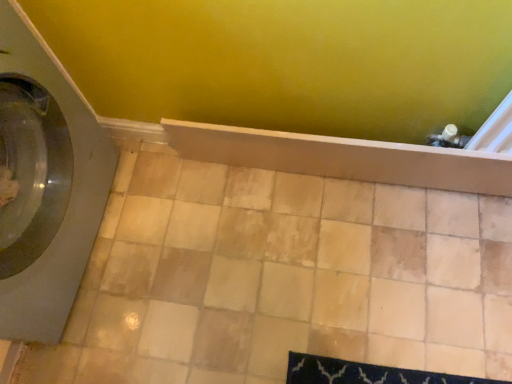
Question: Is satin gray washing machine at left taller than beige ceramic tile at center?

Choices:
 (A) yes
 (B) no

Answer: (A)

Question: Is satin gray washing machine at left facing towards beige ceramic tile at center?

Choices:
 (A) yes
 (B) no

Answer: (A)

Question: Is the depth of satin gray washing machine at left less than that of beige ceramic tile at center?

Choices:
 (A) yes
 (B) no

Answer: (A)

Question: From a real-world perspective, is satin gray washing machine at left located higher than beige ceramic tile at center?

Choices:
 (A) no
 (B) yes

Answer: (B)

Question: Is satin gray washing machine at left next to beige ceramic tile at center?

Choices:
 (A) no
 (B) yes

Answer: (A)

Question: From a real-world perspective, is satin gray washing machine at left below beige ceramic tile at center?

Choices:
 (A) yes
 (B) no

Answer: (B)

Question: Can you confirm if beige ceramic tile at center is shorter than satin gray washing machine at left?

Choices:
 (A) no
 (B) yes

Answer: (B)

Question: Can you see beige ceramic tile at center touching satin gray washing machine at left?

Choices:
 (A) yes
 (B) no

Answer: (B)

Question: Is beige ceramic tile at center to the left of satin gray washing machine at left from the viewer's perspective?

Choices:
 (A) yes
 (B) no

Answer: (B)

Question: Does beige ceramic tile at center appear on the right side of satin gray washing machine at left?

Choices:
 (A) no
 (B) yes

Answer: (B)

Question: Is beige ceramic tile at center oriented towards satin gray washing machine at left?

Choices:
 (A) no
 (B) yes

Answer: (A)

Question: Is beige ceramic tile at center wider than satin gray washing machine at left?

Choices:
 (A) yes
 (B) no

Answer: (A)

Question: Is satin gray washing machine at left taller than wooden shelf at center?

Choices:
 (A) no
 (B) yes

Answer: (B)